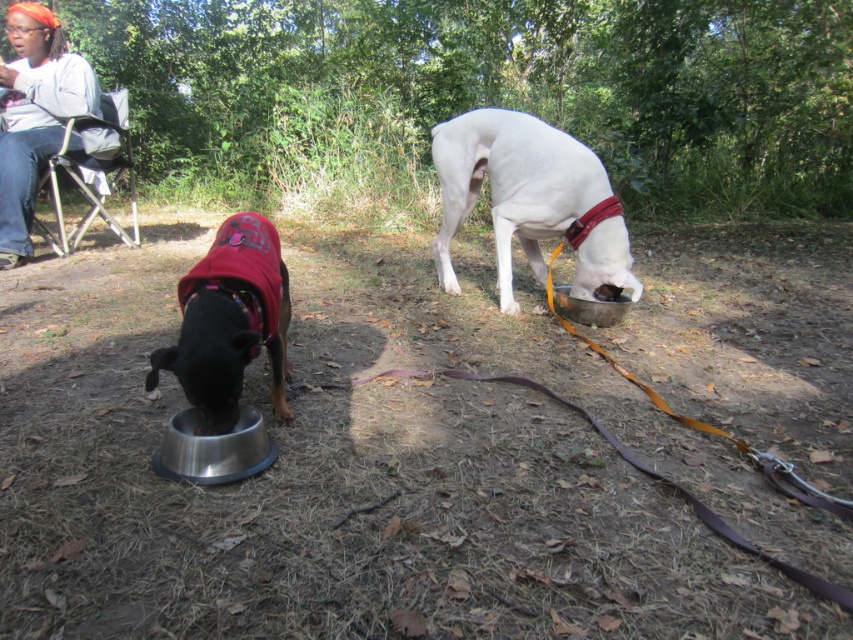
You are standing in the park where the two dogs are eating. The shiny black dog at lower left is your pet. To give it a treat, you need to walk straight towards it from where you are. However, there is a white matte dog bowl at center in the way. Based on their positions, will you need to go around the bowl to reach your dog?

The white matte dog bowl at center is to the right of the shiny black dog at lower left. Since the bowl is to the right of your dog, if you walk straight towards your dog, you won not need to go around the bowl because it is not blocking your path.